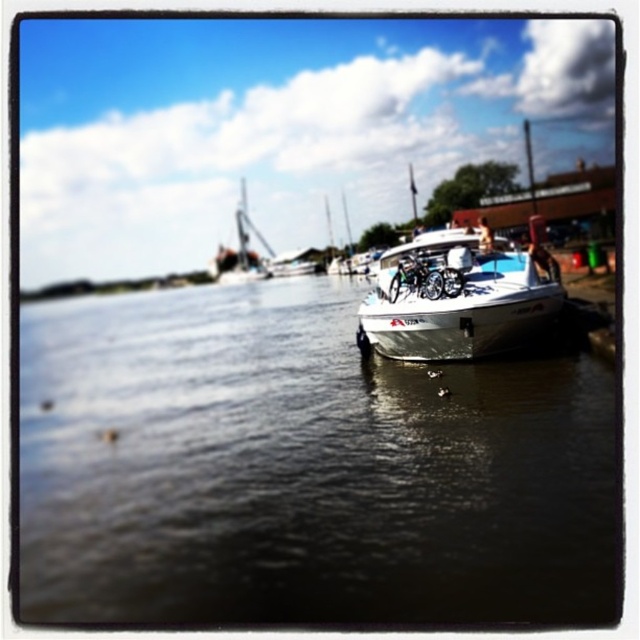
You are standing at the center of the image and want to locate the white glossy boat at right. According to the coordinates provided, in which direction should you look to find it?

The white glossy boat at right is located at coordinates point (301, 468), which means it is positioned to the right and slightly above the center of the image. So you should look to the right and slightly upwards to find it.

You are standing at the riverside and want to know which of the two points, point (323, 541) or point (529, 257), is closer to you. Can you determine this based on the scene?

Point (323, 541) is closer to the viewer than point (529, 257).

You are standing at the riverside and want to take a photo of the white glossy boat at right. If your camera can focus up to 20 feet, will you be able to capture a clear image of the boat?

The white glossy boat at right is 18.91 feet away from camera, so yes, the camera can focus clearly since the distance is within its 20 feet limit.